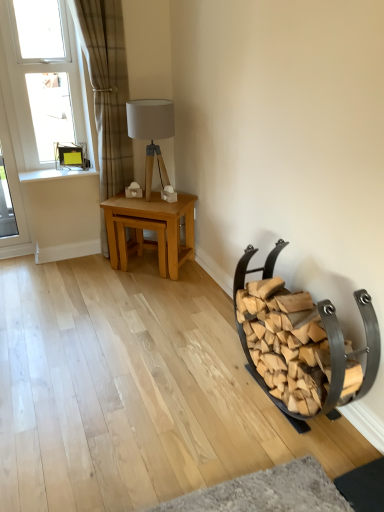
Question: Is wooden firewood rack at lower right outside of matte wood table lamp at center?

Choices:
 (A) no
 (B) yes

Answer: (B)

Question: Is wooden firewood rack at lower right to the right of matte wood table lamp at center from the viewer's perspective?

Choices:
 (A) yes
 (B) no

Answer: (A)

Question: Is wooden firewood rack at lower right facing towards matte wood table lamp at center?

Choices:
 (A) yes
 (B) no

Answer: (B)

Question: From a real-world perspective, is wooden firewood rack at lower right located beneath matte wood table lamp at center?

Choices:
 (A) no
 (B) yes

Answer: (B)

Question: Considering the relative sizes of wooden firewood rack at lower right and matte wood table lamp at center in the image provided, is wooden firewood rack at lower right taller than matte wood table lamp at center?

Choices:
 (A) no
 (B) yes

Answer: (B)

Question: Is white wood at upper left situated inside light oak table at center or outside?

Choices:
 (A) outside
 (B) inside

Answer: (A)

Question: In terms of height, does white wood at upper left look taller or shorter compared to light oak table at center?

Choices:
 (A) short
 (B) tall

Answer: (A)

Question: Is white wood at upper left in front of or behind light oak table at center in the image?

Choices:
 (A) behind
 (B) front

Answer: (A)

Question: Is white wood at upper left wider or thinner than light oak table at center?

Choices:
 (A) wide
 (B) thin

Answer: (B)

Question: Is light oak table at center to the left or to the right of white plastic window at upper left in the image?

Choices:
 (A) right
 (B) left

Answer: (A)

Question: From the image's perspective, relative to white plastic window at upper left, is light oak table at center above or below?

Choices:
 (A) above
 (B) below

Answer: (B)

Question: From a real-world perspective, is light oak table at center positioned above or below white plastic window at upper left?

Choices:
 (A) below
 (B) above

Answer: (A)

Question: In terms of width, does light oak table at center look wider or thinner when compared to white plastic window at upper left?

Choices:
 (A) thin
 (B) wide

Answer: (B)

Question: Is point (240, 336) positioned closer to the camera than point (44, 178)?

Choices:
 (A) closer
 (B) farther

Answer: (A)

Question: Is wooden firewood rack at lower right wider or thinner than white wood at upper left?

Choices:
 (A) thin
 (B) wide

Answer: (B)